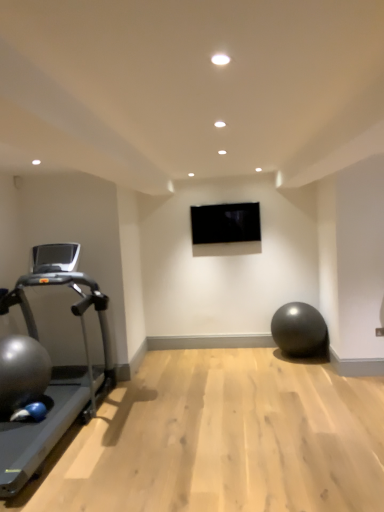
Question: Considering the relative sizes of matte black ball at lower right, which is the second ball in front-to-back order, and silver metallic treadmill at left in the image provided, is matte black ball at lower right, which is the second ball in front-to-back order, smaller than silver metallic treadmill at left?

Choices:
 (A) no
 (B) yes

Answer: (B)

Question: Is silver metallic treadmill at left at the back of matte black ball at lower right, which appears as the 2th ball when viewed from the left?

Choices:
 (A) no
 (B) yes

Answer: (A)

Question: Is matte black ball at lower right, which is the first ball from right to left, taller than silver metallic treadmill at left?

Choices:
 (A) no
 (B) yes

Answer: (A)

Question: From a real-world perspective, is matte black ball at lower right, which appears as the 2th ball when viewed from the left, located higher than silver metallic treadmill at left?

Choices:
 (A) yes
 (B) no

Answer: (B)

Question: Considering the relative positions of matte black ball at lower right, which is the first ball from right to left, and silver metallic treadmill at left in the image provided, is matte black ball at lower right, which is the first ball from right to left, in front of silver metallic treadmill at left?

Choices:
 (A) no
 (B) yes

Answer: (A)

Question: Considering their positions, is black glossy tv at center located in front of or behind silver metallic treadmill at left?

Choices:
 (A) behind
 (B) front

Answer: (A)

Question: From a real-world perspective, relative to silver metallic treadmill at left, is black glossy tv at center vertically above or below?

Choices:
 (A) below
 (B) above

Answer: (B)

Question: Visually, is black glossy tv at center positioned to the left or to the right of silver metallic treadmill at left?

Choices:
 (A) right
 (B) left

Answer: (A)

Question: Is point (213, 220) closer or farther from the camera than point (84, 420)?

Choices:
 (A) farther
 (B) closer

Answer: (A)

Question: Considering the positions of point (324, 345) and point (48, 373), is point (324, 345) closer or farther from the camera than point (48, 373)?

Choices:
 (A) farther
 (B) closer

Answer: (A)

Question: Is matte black ball at lower right, which is the second ball in front-to-back order, inside or outside of shiny metallic ball at left, the first ball positioned from the front?

Choices:
 (A) inside
 (B) outside

Answer: (B)

Question: From a real-world perspective, is matte black ball at lower right, marked as the first ball in a back-to-front arrangement, positioned above or below shiny metallic ball at left, the second ball positioned from the back?

Choices:
 (A) below
 (B) above

Answer: (A)

Question: Is matte black ball at lower right, which is the second ball in front-to-back order, bigger or smaller than shiny metallic ball at left, the first ball positioned from the front?

Choices:
 (A) big
 (B) small

Answer: (B)

Question: Based on their sizes in the image, would you say silver metallic treadmill at left is bigger or smaller than black glossy tv at center?

Choices:
 (A) small
 (B) big

Answer: (B)

Question: Considering the positions of silver metallic treadmill at left and black glossy tv at center in the image, is silver metallic treadmill at left wider or thinner than black glossy tv at center?

Choices:
 (A) wide
 (B) thin

Answer: (A)